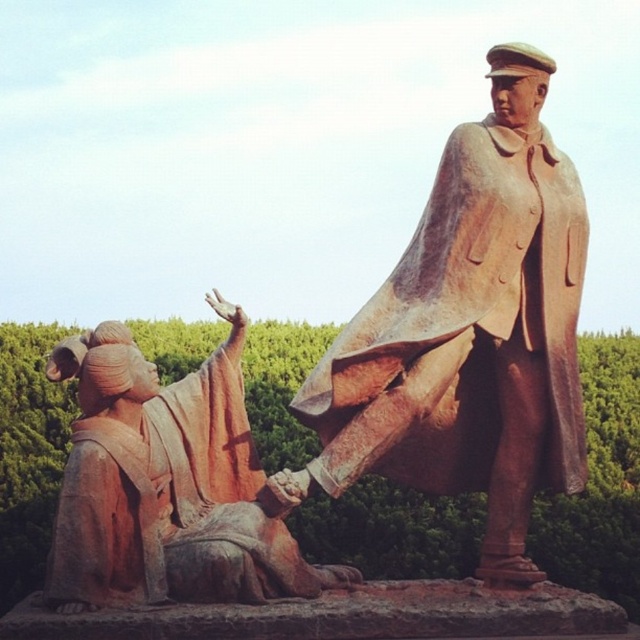
Question: From the image, what is the correct spatial relationship of rustic bronze statue at upper right in relation to rustic stone statue at lower left?

Choices:
 (A) right
 (B) left

Answer: (A)

Question: Among these points, which one is nearest to the camera?

Choices:
 (A) (230, 468)
 (B) (483, 305)

Answer: (B)

Question: Does rustic bronze statue at upper right have a smaller size compared to rustic stone statue at lower left?

Choices:
 (A) no
 (B) yes

Answer: (B)

Question: Can you confirm if rustic bronze statue at upper right is positioned to the right of rustic stone statue at lower left?

Choices:
 (A) no
 (B) yes

Answer: (B)

Question: Which of the following is the farthest from the observer?

Choices:
 (A) (204, 449)
 (B) (531, 64)

Answer: (B)

Question: Which object appears closest to the camera in this image?

Choices:
 (A) rustic bronze statue at upper right
 (B) rustic stone statue at lower left

Answer: (B)